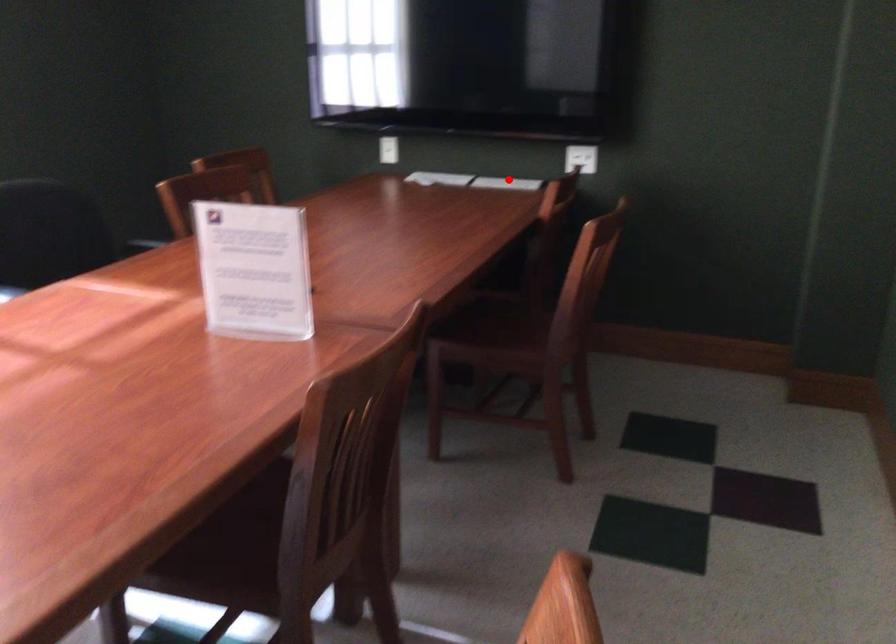
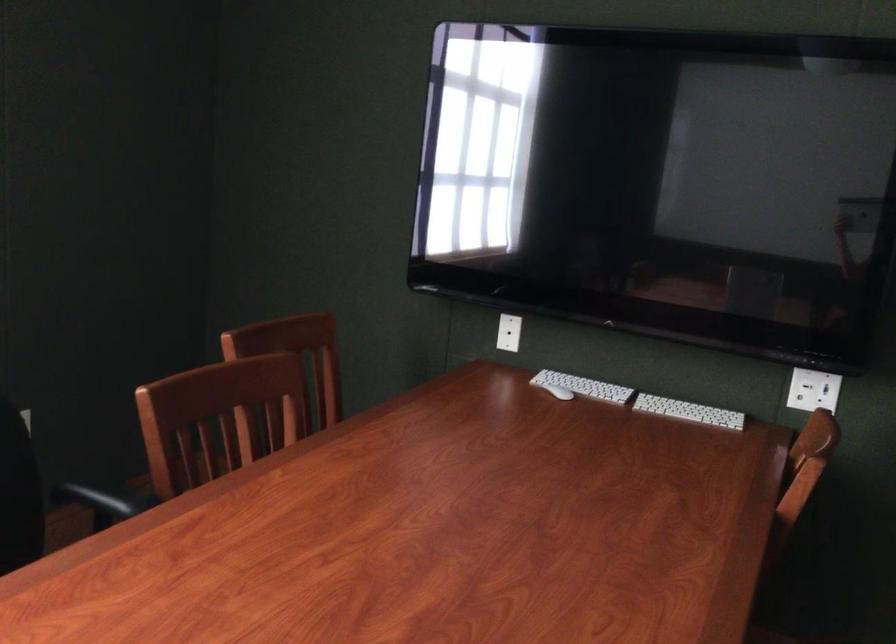
Question: A red point is marked in image1. In image2, is the corresponding 3D point closer to the camera or farther? Reply with the corresponding letter.

Choices:
 (A) The corresponding 3D point is closer.
 (B) The corresponding 3D point is farther.

Answer: (A)